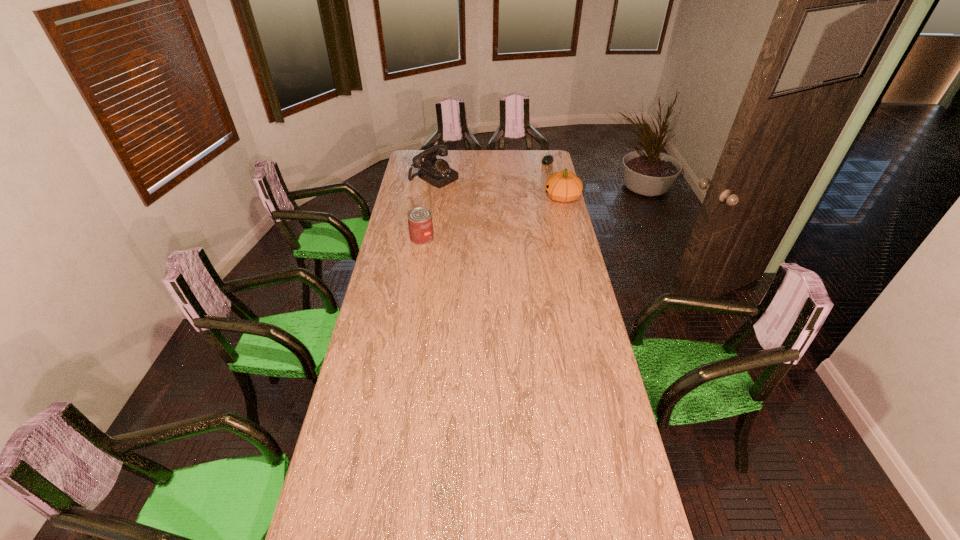
The height and width of the screenshot is (540, 960). Find the location of `free spot on the desktop that is between the nearest object and the gourd and is positioned on the wheel side of the computer mouse`. free spot on the desktop that is between the nearest object and the gourd and is positioned on the wheel side of the computer mouse is located at coordinates (508, 213).

Identify the location of free space on the desktop that is between the second shortest object and the gourd and is positioned on the dial of the telephone. This screenshot has width=960, height=540. (502, 215).